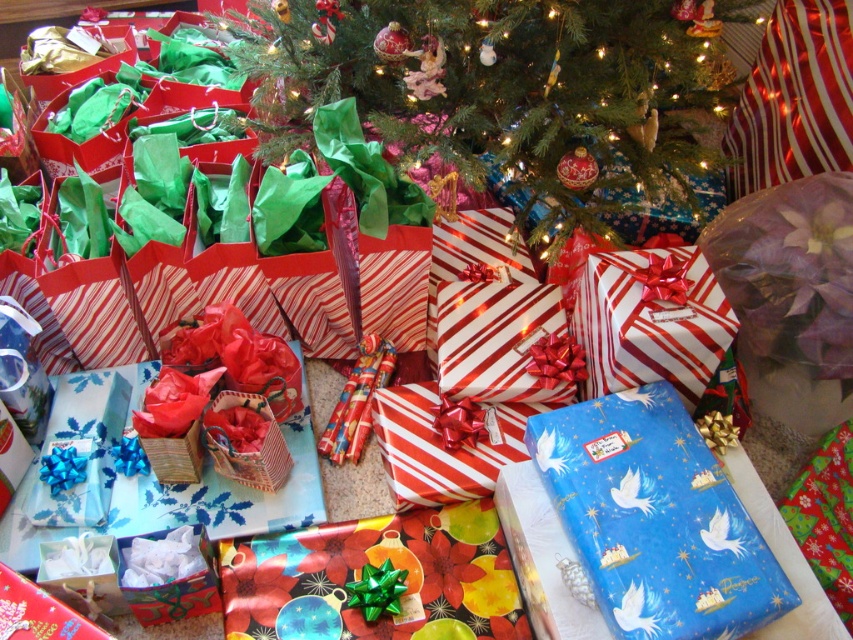
Which is above, green paper christmas tree at center or white striped paper gift at center?

Positioned higher is green paper christmas tree at center.

Who is lower down, green paper christmas tree at center or white striped paper gift at center?

Positioned lower is white striped paper gift at center.

Is point (682, 132) farther from camera compared to point (633, 324)?

Yes, it is behind point (633, 324).

This screenshot has height=640, width=853. Identify the location of green paper christmas tree at center. (505, 90).

Between blue glossy gift at center and white striped paper gift at center, which one appears on the left side from the viewer's perspective?

Positioned to the left is white striped paper gift at center.

Find the location of a particular element. The image size is (853, 640). blue glossy gift at center is located at coordinates (654, 518).

Is point (619, 468) behind point (677, 294)?

No, it is not.

The image size is (853, 640). In order to click on blue glossy gift at center in this screenshot , I will do `click(654, 518)`.

Is point (693, 84) closer to camera compared to point (566, 484)?

That is False.

Between point (403, 33) and point (560, 452), which one is positioned behind?

Positioned behind is point (403, 33).

Where is `green paper christmas tree at center`? Image resolution: width=853 pixels, height=640 pixels. green paper christmas tree at center is located at coordinates (505, 90).